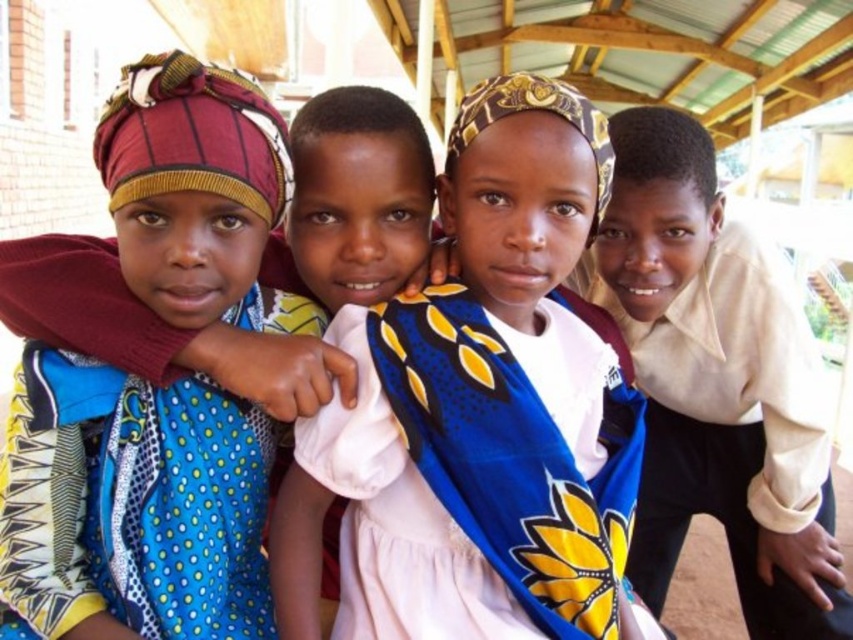
You are a photographer trying to capture a group photo of the light beige shirt at right and the yellow printed dress at center. Since you want to ensure both subjects are fully visible, which subject requires more space in the frame?

The light beige shirt at right requires more space in the frame because its width surpasses that of the yellow printed dress at center.

You are standing at the camera position and want to reach point [154,211]. Is the distance less than 5 feet?

The distance between the camera and point [154,211] is 4.72 feet, which is less than 5 feet.